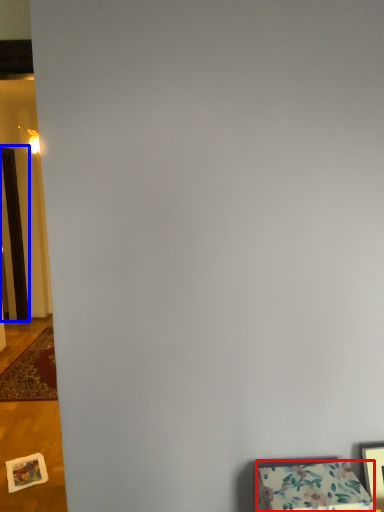
Question: Which point is closer to the camera, furniture (highlighted by a red box) or door (highlighted by a blue box)?

Choices:
 (A) furniture
 (B) door

Answer: (A)